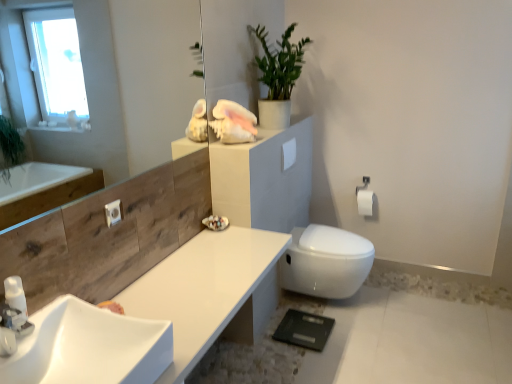
Question: Is white matte toilet paper at upper right, arranged as the first toilet paper when viewed from the left, not near white matte toilet paper at right, which ranks as the first toilet paper in back-to-front order?

Choices:
 (A) yes
 (B) no

Answer: (B)

Question: Does white matte toilet paper at upper right, placed as the first toilet paper when sorted from front to back, appear on the right side of white matte toilet paper at right, which is the 2th toilet paper from front to back?

Choices:
 (A) no
 (B) yes

Answer: (A)

Question: Could you tell me if white matte toilet paper at upper right, placed as the first toilet paper when sorted from front to back, is facing white matte toilet paper at right, which is the 2th toilet paper from front to back?

Choices:
 (A) no
 (B) yes

Answer: (A)

Question: Can you confirm if white matte toilet paper at upper right, the first toilet paper when ordered from top to bottom, is bigger than white matte toilet paper at right, which ranks as the first toilet paper in back-to-front order?

Choices:
 (A) no
 (B) yes

Answer: (A)

Question: From a real-world perspective, is white matte toilet paper at upper right, the first toilet paper when ordered from top to bottom, under white matte toilet paper at right, marked as the 1th toilet paper in a right-to-left arrangement?

Choices:
 (A) no
 (B) yes

Answer: (A)

Question: Does white matte toilet paper at upper right, which appears as the second toilet paper when viewed from the right, have a lesser height compared to white matte toilet paper at right, which is the 2th toilet paper from front to back?

Choices:
 (A) yes
 (B) no

Answer: (A)

Question: Is green matte plant at upper center positioned behind white matte toilet paper at right, the second toilet paper positioned from the left?

Choices:
 (A) no
 (B) yes

Answer: (A)

Question: Is green matte plant at upper center looking in the opposite direction of white matte toilet paper at right, which ranks as the first toilet paper in back-to-front order?

Choices:
 (A) no
 (B) yes

Answer: (A)

Question: Is white matte toilet paper at right, the second toilet paper positioned from the left, inside green matte plant at upper center?

Choices:
 (A) no
 (B) yes

Answer: (A)

Question: From the image's perspective, is green matte plant at upper center under white matte toilet paper at right, which ranks as the first toilet paper in back-to-front order?

Choices:
 (A) no
 (B) yes

Answer: (A)

Question: Is green matte plant at upper center in front of white matte toilet paper at right, the first toilet paper ordered from the bottom?

Choices:
 (A) no
 (B) yes

Answer: (B)

Question: Is green matte plant at upper center taller than white matte toilet paper at right, the 2th toilet paper from the top?

Choices:
 (A) yes
 (B) no

Answer: (A)

Question: Can you confirm if transparent glass mirror at upper left is positioned to the right of white glossy soap dispenser at lower left?

Choices:
 (A) yes
 (B) no

Answer: (A)